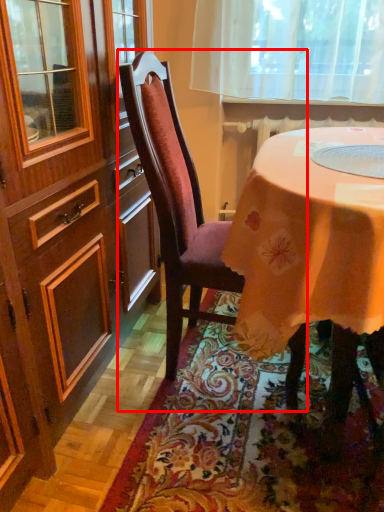
Question: Observing the image, what is the correct spatial positioning of chair (annotated by the red box) in reference to mat?

Choices:
 (A) right
 (B) left

Answer: (B)